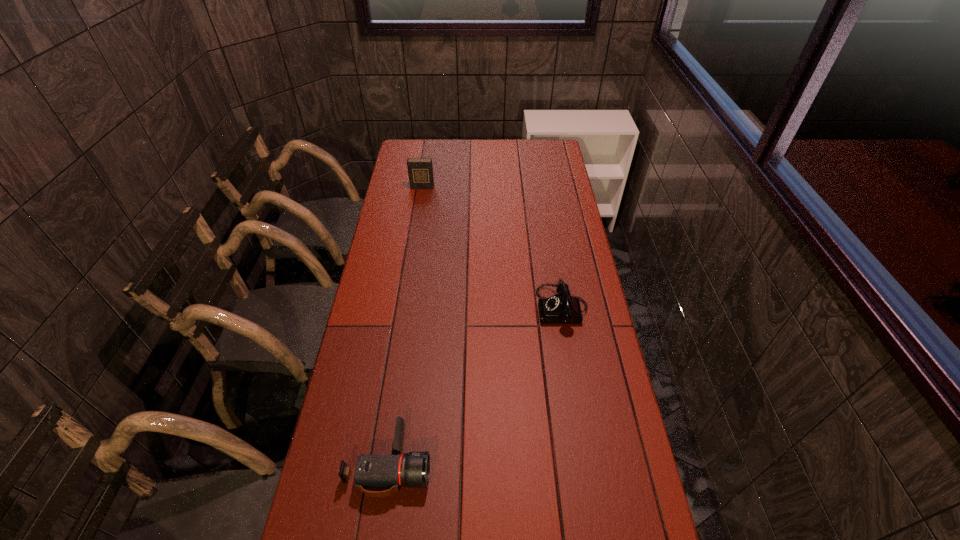
Identify the location of free spot between the tallest object and the nearest object. The image size is (960, 540). (406, 325).

Where is `vacant space that's between the farthest object and the camcorder`? vacant space that's between the farthest object and the camcorder is located at coordinates (406, 325).

Where is `blank region between the rightmost object and the diary`? This screenshot has width=960, height=540. blank region between the rightmost object and the diary is located at coordinates (492, 248).

Locate an element on the screen. The image size is (960, 540). free space between the rightmost object and the tallest object is located at coordinates 492,248.

Where is `vacant point located between the rightmost object and the shortest object`? The height and width of the screenshot is (540, 960). vacant point located between the rightmost object and the shortest object is located at coordinates (476, 386).

Where is `empty location between the camcorder and the diary`? The height and width of the screenshot is (540, 960). empty location between the camcorder and the diary is located at coordinates (406, 325).

Find the location of a particular element. This screenshot has height=540, width=960. empty space that is in between the shortest object and the second nearest object is located at coordinates (476, 386).

In order to click on object that is the second closest one to the diary in this screenshot , I will do `click(372, 472)`.

Locate an element on the screen. The width and height of the screenshot is (960, 540). the second closest object relative to the camcorder is located at coordinates (420, 170).